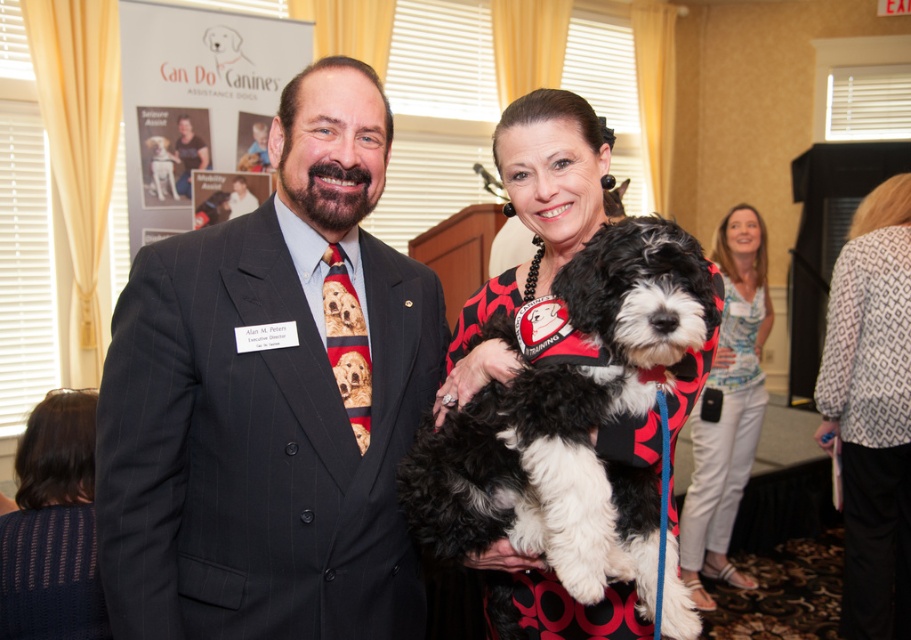
Between matte black suit at center and fluffy black-and-white dog at center, which one has more height?

With more height is matte black suit at center.

Is point (265, 417) positioned before point (589, 490)?

No, (265, 417) is behind (589, 490).

Between point (181, 368) and point (433, 492), which one is positioned behind?

Positioned behind is point (433, 492).

Locate an element on the screen. This screenshot has width=911, height=640. matte black suit at center is located at coordinates (271, 403).

Is fluffy black-and-white dog at center wider than white printed blouse at upper right?

Indeed, fluffy black-and-white dog at center has a greater width compared to white printed blouse at upper right.

Is fluffy black-and-white dog at center smaller than white printed blouse at upper right?

Yes.

Who is more forward, (651, 605) or (846, 310)?

Positioned in front is point (651, 605).

This screenshot has width=911, height=640. In order to click on fluffy black-and-white dog at center in this screenshot , I will do `click(574, 428)`.

Does point (906, 380) come closer to viewer compared to point (722, 577)?

Yes, point (906, 380) is closer to viewer.

Identify the location of white printed blouse at upper right. Image resolution: width=911 pixels, height=640 pixels. (872, 410).

Find the location of a particular element. This screenshot has height=640, width=911. white printed blouse at upper right is located at coordinates (872, 410).